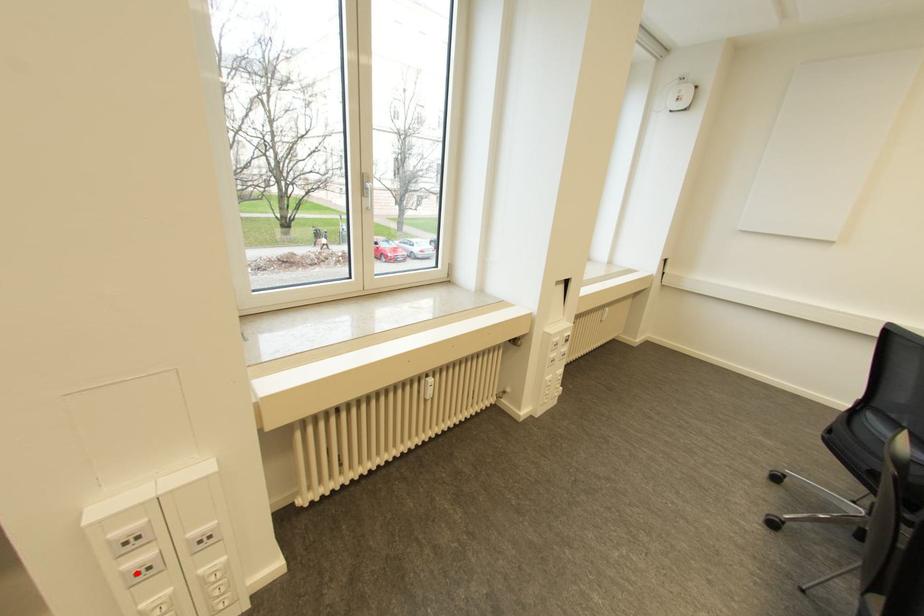
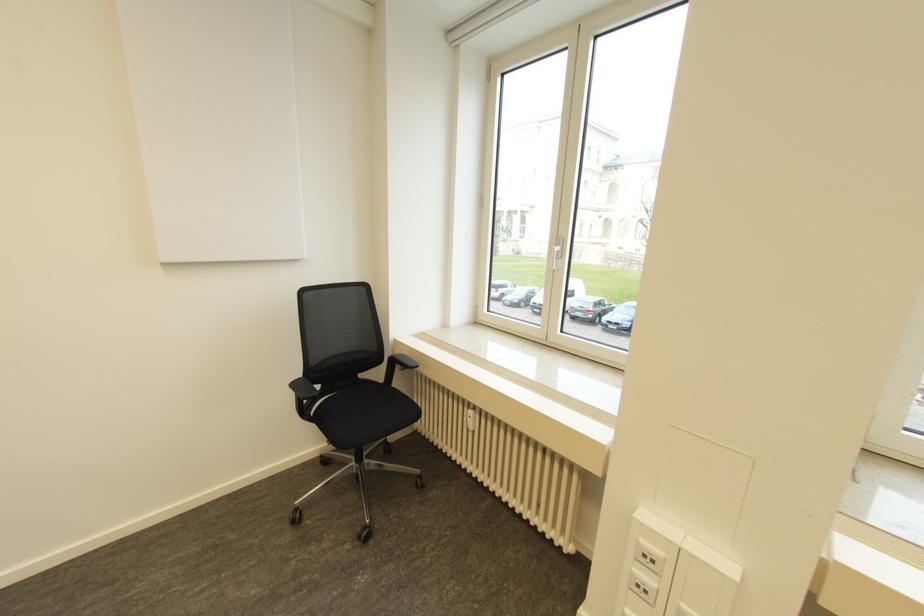
Question: I am providing you with two images of the same scene from different viewpoints. In image1, a red point is highlighted. Considering the same 3D point in image2, which of the following is correct?

Choices:
 (A) It is closer
 (B) It is farther

Answer: (B)